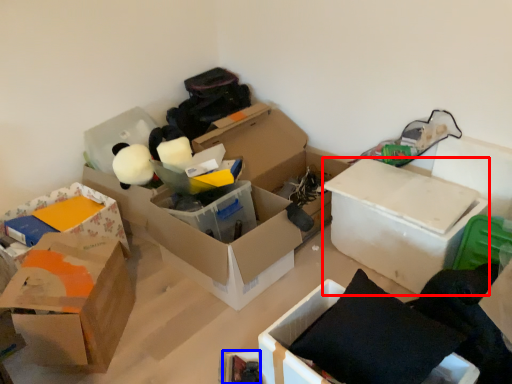
Question: Which object appears closest to the camera in this image, box (highlighted by a red box) or storage box (highlighted by a blue box)?

Choices:
 (A) box
 (B) storage box

Answer: (B)